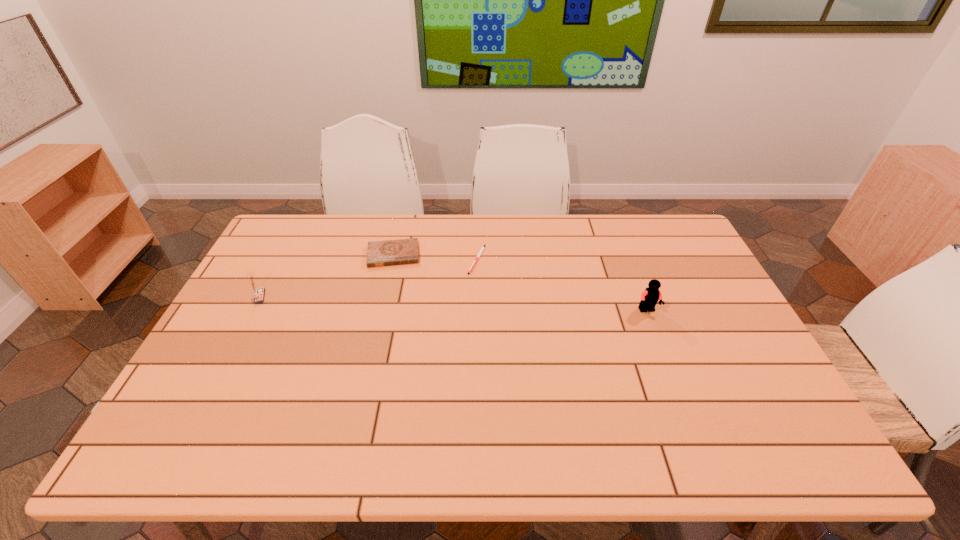
I want to click on the leftmost object, so click(258, 293).

Identify the location of matchbox. (258, 293).

The width and height of the screenshot is (960, 540). What are the coordinates of `the rightmost object` in the screenshot? It's located at (649, 298).

Where is `the nearest object`? This screenshot has width=960, height=540. the nearest object is located at coordinates (649, 298).

Find the location of a particular element. pen is located at coordinates (479, 254).

This screenshot has width=960, height=540. Identify the location of the shortest object. (479, 254).

Find the location of a particular element. The height and width of the screenshot is (540, 960). the second shortest object is located at coordinates (402, 251).

At what (x,y) coordinates should I click in order to perform the action: click on diary. Please return your answer as a coordinate pair (x, y). The image size is (960, 540). Looking at the image, I should click on (402, 251).

Locate an element on the screen. free space located 0.100m on the front of the matchbox is located at coordinates (241, 330).

Locate an element on the screen. Image resolution: width=960 pixels, height=540 pixels. vacant region located 0.060m on the front-facing side of the nearest object is located at coordinates (656, 332).